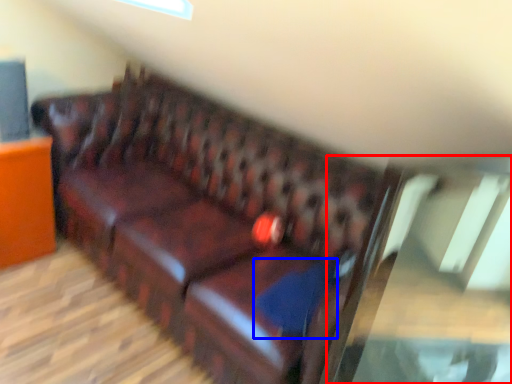
Question: Which object is closer to the camera taking this photo, glass table (highlighted by a red box) or pillow (highlighted by a blue box)?

Choices:
 (A) glass table
 (B) pillow

Answer: (A)